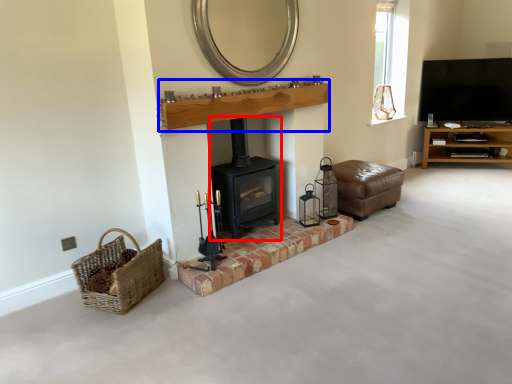
Question: Which of the following is the farthest to the observer, wood burning stove (highlighted by a red box) or mantle (highlighted by a blue box)?

Choices:
 (A) wood burning stove
 (B) mantle

Answer: (A)